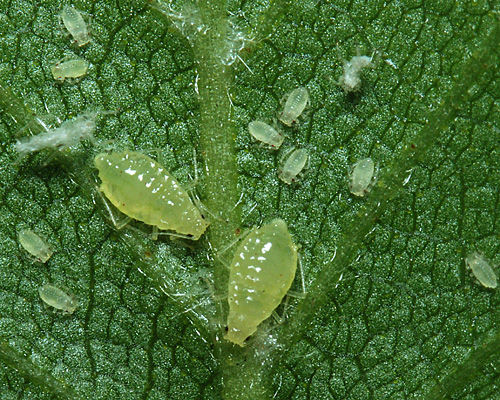
Locate an element on the screen. left front leg is located at coordinates (220, 294), (193, 183).